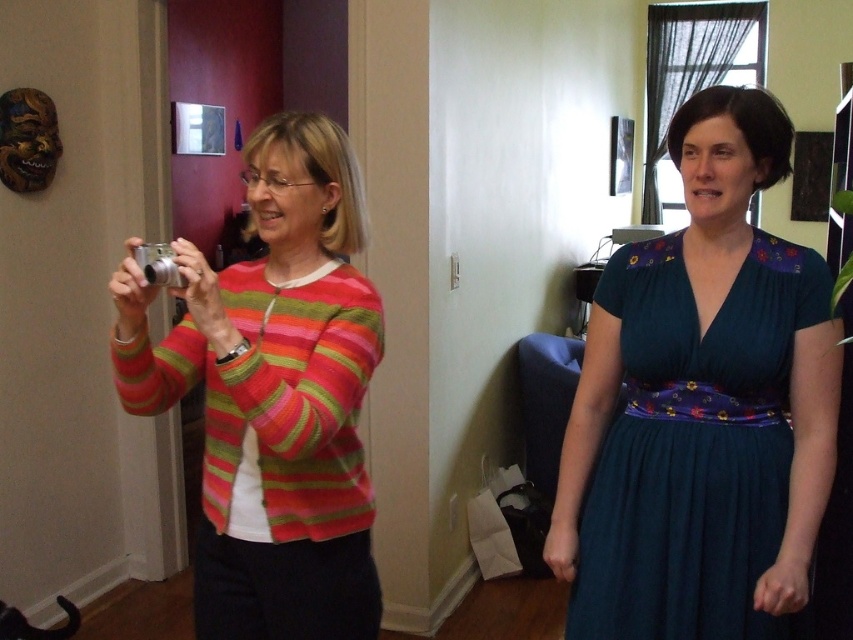
Question: Which of the following is the farthest from the observer?

Choices:
 (A) 207,480
 (B) 170,285
 (C) 770,536

Answer: (A)

Question: Which of the following is the closest to the observer?

Choices:
 (A) striped knit sweater at left
 (B) dark blue satin dress at center

Answer: (A)

Question: Can you confirm if striped knit sweater at left is positioned below silver metallic camera at left?

Choices:
 (A) yes
 (B) no

Answer: (A)

Question: Can you confirm if striped knit sweater at left is positioned above silver metallic camera at left?

Choices:
 (A) yes
 (B) no

Answer: (B)

Question: Does dark blue satin dress at center have a larger size compared to silver metallic camera at left?

Choices:
 (A) yes
 (B) no

Answer: (A)

Question: Based on their relative distances, which object is nearer to the silver metallic camera at left?

Choices:
 (A) striped knit sweater at left
 (B) dark blue satin dress at center

Answer: (A)